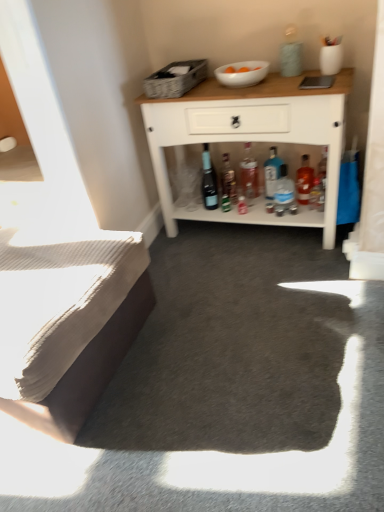
Question: From the image's perspective, is blue glass bottle at center, arranged as the third bottle when viewed from the right, over translucent plastic bottle at center, acting as the 4th bottle starting from the right?

Choices:
 (A) yes
 (B) no

Answer: (B)

Question: Is blue glass bottle at center, the 4th bottle in the left-to-right sequence, shorter than translucent plastic bottle at center, acting as the 4th bottle starting from the right?

Choices:
 (A) yes
 (B) no

Answer: (A)

Question: Considering the relative positions of blue glass bottle at center, arranged as the third bottle when viewed from the right, and translucent plastic bottle at center, positioned as the 3th bottle in left-to-right order, in the image provided, is blue glass bottle at center, arranged as the third bottle when viewed from the right, to the right of translucent plastic bottle at center, positioned as the 3th bottle in left-to-right order, from the viewer's perspective?

Choices:
 (A) no
 (B) yes

Answer: (B)

Question: Considering the relative positions of blue glass bottle at center, arranged as the third bottle when viewed from the right, and translucent plastic bottle at center, acting as the 4th bottle starting from the right, in the image provided, is blue glass bottle at center, arranged as the third bottle when viewed from the right, to the left of translucent plastic bottle at center, acting as the 4th bottle starting from the right, from the viewer's perspective?

Choices:
 (A) yes
 (B) no

Answer: (B)

Question: Can you confirm if blue glass bottle at center, the 4th bottle in the left-to-right sequence, is taller than translucent plastic bottle at center, acting as the 4th bottle starting from the right?

Choices:
 (A) yes
 (B) no

Answer: (B)

Question: From the image's perspective, would you say blue glass bottle at center, arranged as the third bottle when viewed from the right, is shown under translucent plastic bottle at center, acting as the 4th bottle starting from the right?

Choices:
 (A) yes
 (B) no

Answer: (A)

Question: Is woven fabric picnic basket at upper center facing towards white wood cabinet at upper center?

Choices:
 (A) yes
 (B) no

Answer: (B)

Question: Is woven fabric picnic basket at upper center thinner than white wood cabinet at upper center?

Choices:
 (A) no
 (B) yes

Answer: (A)

Question: From a real-world perspective, is woven fabric picnic basket at upper center on top of white wood cabinet at upper center?

Choices:
 (A) no
 (B) yes

Answer: (B)

Question: Considering the relative positions of woven fabric picnic basket at upper center and white wood cabinet at upper center in the image provided, is woven fabric picnic basket at upper center to the right of white wood cabinet at upper center from the viewer's perspective?

Choices:
 (A) no
 (B) yes

Answer: (A)

Question: Can you confirm if woven fabric picnic basket at upper center is wider than white wood cabinet at upper center?

Choices:
 (A) no
 (B) yes

Answer: (B)

Question: Does woven fabric picnic basket at upper center come behind white wood cabinet at upper center?

Choices:
 (A) yes
 (B) no

Answer: (A)

Question: Is translucent glass bottle at center, the sixth bottle in the left-to-right sequence, positioned in front of beige textured bed at lower left?

Choices:
 (A) no
 (B) yes

Answer: (A)